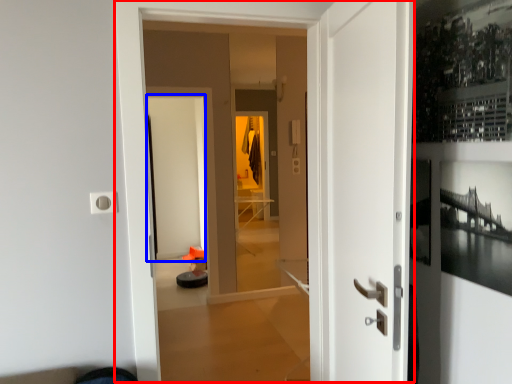
Question: Which of the following is the farthest to the observer, door (highlighted by a red box) or screen door (highlighted by a blue box)?

Choices:
 (A) door
 (B) screen door

Answer: (B)